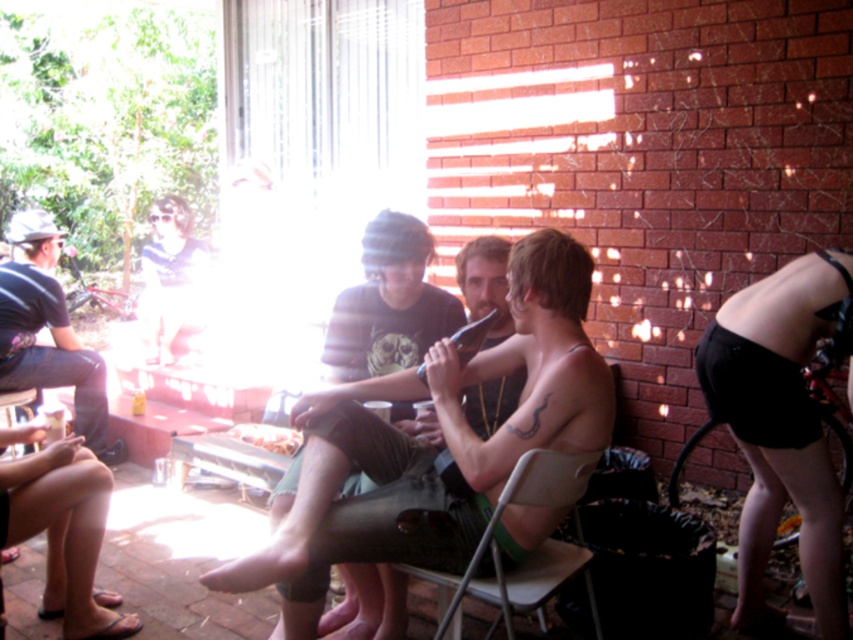
You are planning to place a decorative item on a small table that can only hold items larger than the black fabric shorts at right. Can the shiny metallic flute at center be placed there?

The shiny metallic flute at center is bigger than black fabric shorts at right, so yes, it can be placed on the table since it meets the size requirement.

You are organizing a clothing donation drive and need to categorize items based on their material thickness. You have two items to assess in the image provided. Which of the two items, the black fabric shorts at right or the dark blue jeans at left, is more suitable for summer wear based on their material thickness?

The black fabric shorts at right is thinner than the dark blue jeans at left, making it more suitable for summer wear as thinner materials are typically cooler and more breathable.